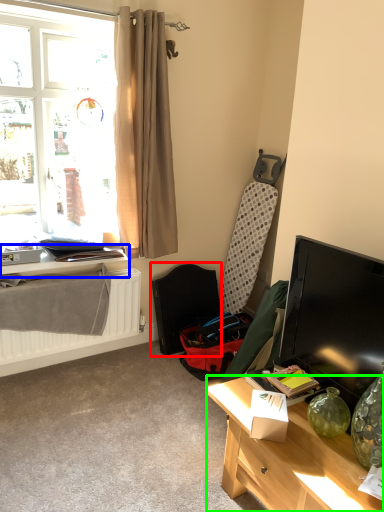
Question: Which is nearer to the folding chair (highlighted by a red box)? table (highlighted by a blue box) or desk (highlighted by a green box).

Choices:
 (A) table
 (B) desk

Answer: (A)